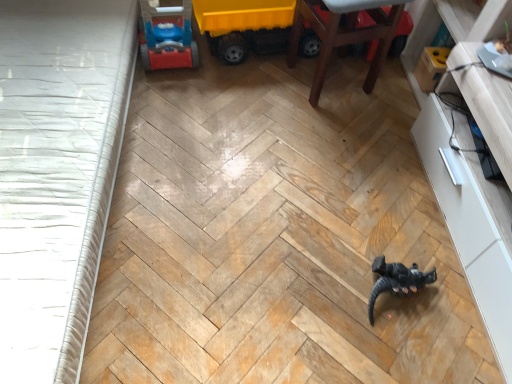
Identify the location of vacant space situated on the left part of black matte dinosaur at center, which is the 2th toy in top-to-bottom order. (331, 279).